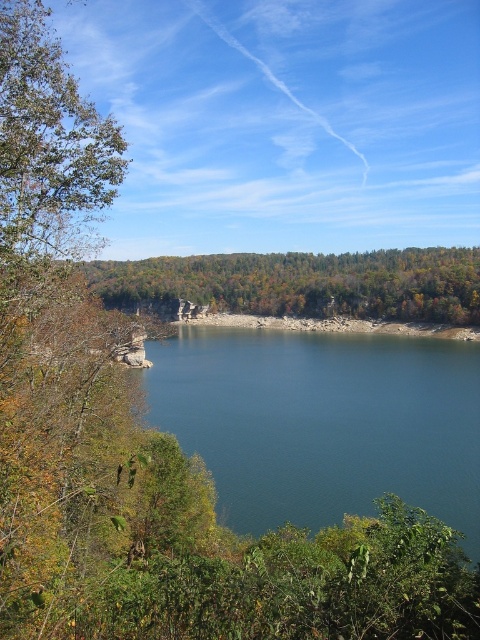
Question: Can you confirm if deep blue water at center is wider than green leafy trees at center?

Choices:
 (A) yes
 (B) no

Answer: (B)

Question: Which object is closer to the camera taking this photo?

Choices:
 (A) green leafy trees at center
 (B) deep blue water at center

Answer: (B)

Question: Can you confirm if deep blue water at center is smaller than green leafy trees at center?

Choices:
 (A) no
 (B) yes

Answer: (B)

Question: Observing the image, what is the correct spatial positioning of deep blue water at center in reference to green leafy trees at center?

Choices:
 (A) left
 (B) right

Answer: (A)

Question: Which object is farther from the camera taking this photo?

Choices:
 (A) green leafy trees at center
 (B) deep blue water at center

Answer: (A)